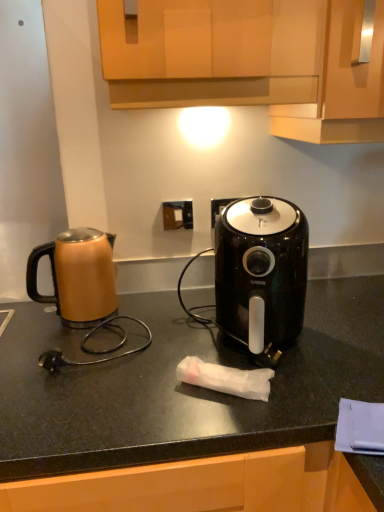
Find the location of a particular element. The height and width of the screenshot is (512, 384). vacant point to the right of matte brown kettle at left is located at coordinates (158, 326).